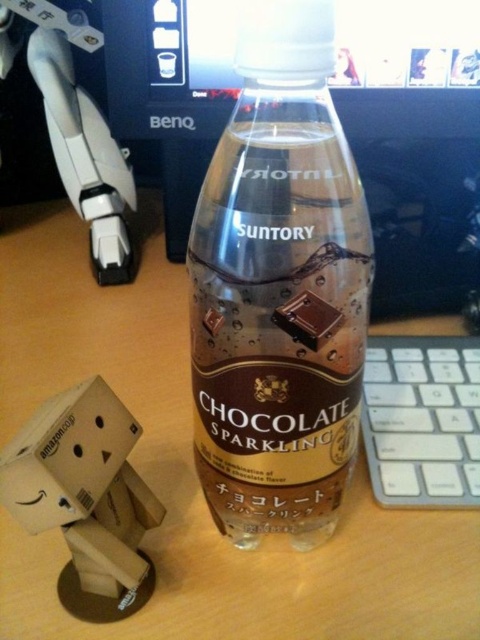
You are organizing items on a shelf and want to place both the brown matte plastic bottle at center and the chocolate matte at bottle center. Since space is limited, you need to know which item is wider. Which one is wider?

The brown matte plastic bottle at center is wider than the chocolate matte at bottle center.

You are standing in front of the wooden desk with the Suntory Chocolate Sparkling drink bottle and the Amazon cardboard box figurine. There are two points marked on the desk at coordinates point (75, 625) and point (268, 241). Which point is closer to you?

Point (75, 625) is further to the viewer than point (268, 241), so the point closer to you is point (268, 241).

In the scene shown: You are trying to locate the white plastic keyboard at right on a desk. What are the coordinates where you should look?

The white plastic keyboard at right is located at point (422,420).